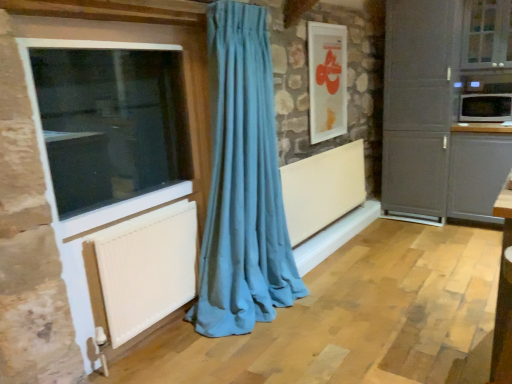
Where is `free area in between matte gray cabinet at right, which appears as the 1th cabinetry when viewed from the right, and teal fabric curtain at center`? free area in between matte gray cabinet at right, which appears as the 1th cabinetry when viewed from the right, and teal fabric curtain at center is located at coordinates (388, 263).